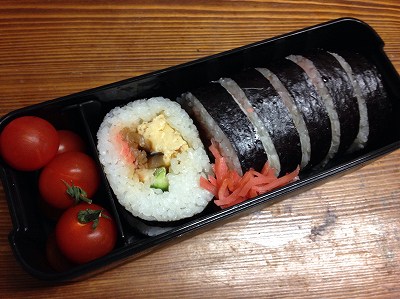
Image resolution: width=400 pixels, height=299 pixels. Identify the location of tray. (160, 232), (191, 74).